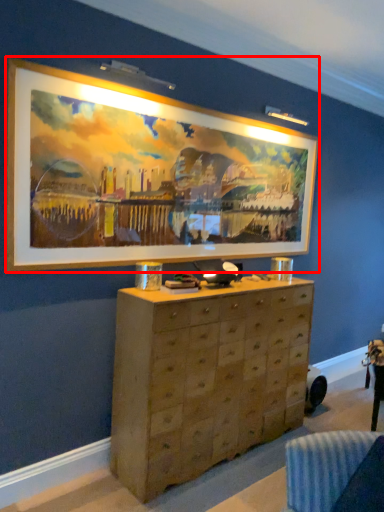
Question: From the image's perspective, considering the relative positions of picture frame (annotated by the red box) and chest of drawers in the image provided, where is picture frame (annotated by the red box) located with respect to the staircase?

Choices:
 (A) below
 (B) above

Answer: (B)